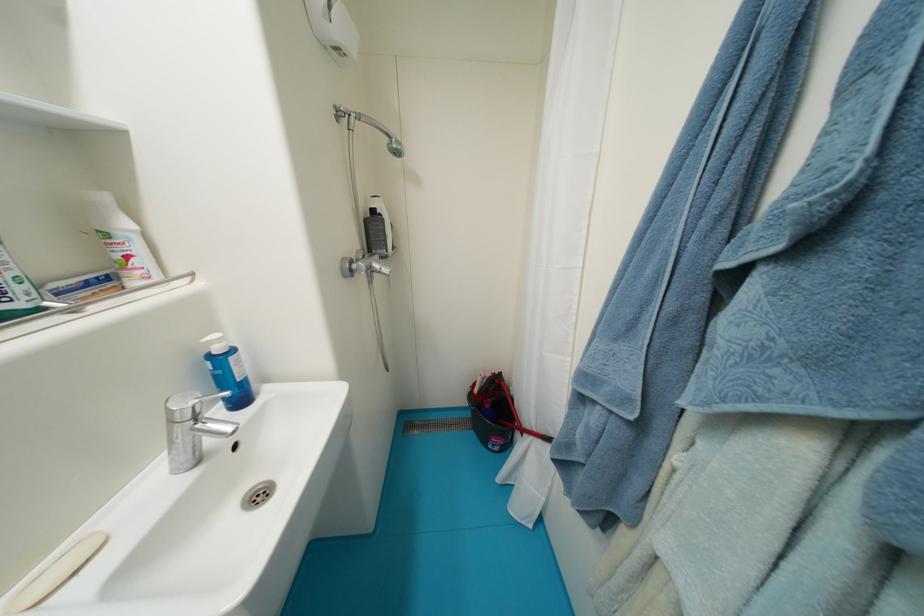
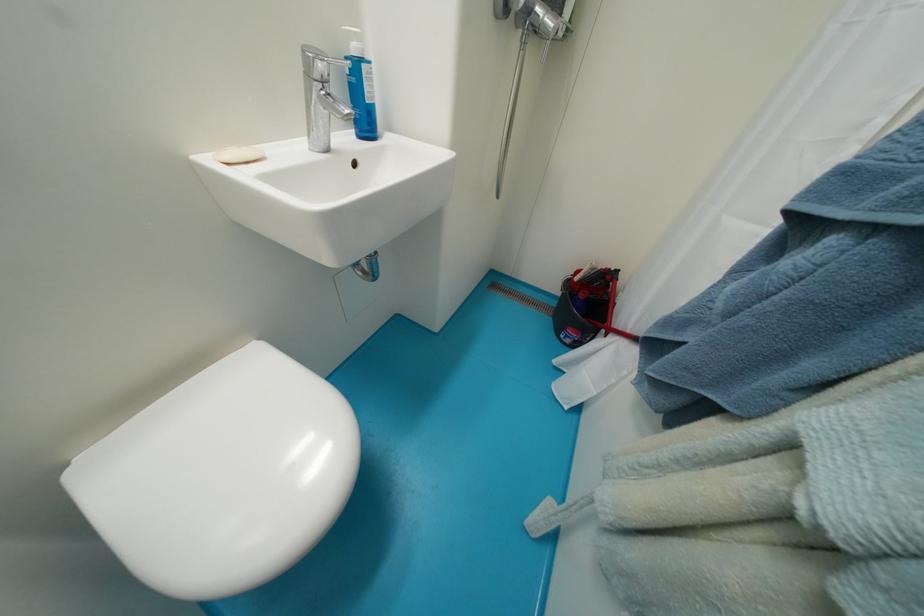
In the second image, find the point that corresponds to (178,424) in the first image.

(313, 78)